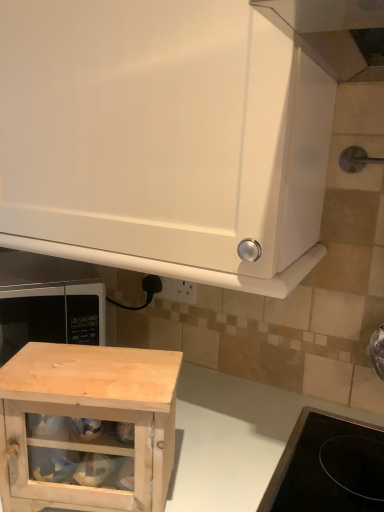
Where is `free point below white glossy cabinet at upper center, the first cabinetry from the top (from a real-world perspective)`? This screenshot has width=384, height=512. free point below white glossy cabinet at upper center, the first cabinetry from the top (from a real-world perspective) is located at coordinates (218, 416).